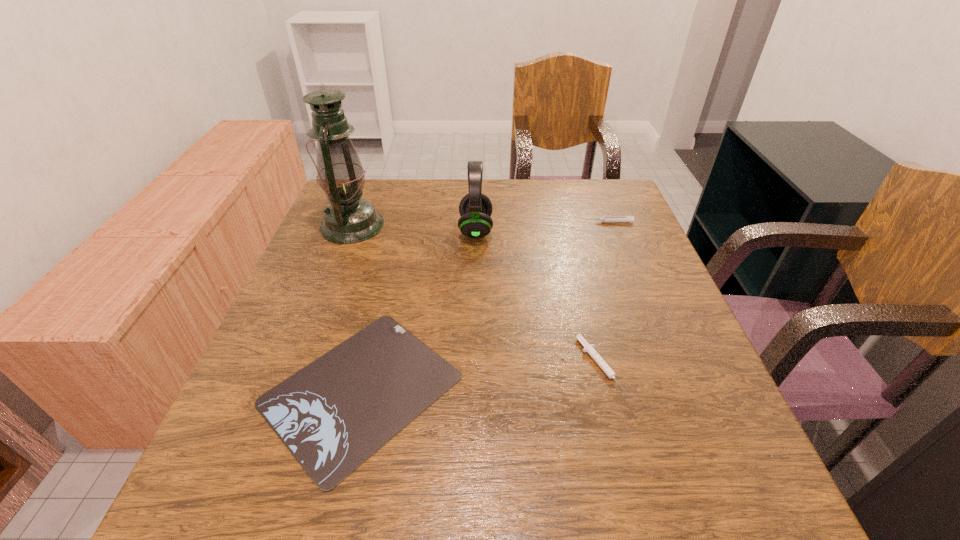
This screenshot has width=960, height=540. What are the coordinates of `object that is at the right edge` in the screenshot? It's located at (630, 219).

Find the location of `object at the far left corner`. object at the far left corner is located at coordinates (348, 219).

Find the location of a particular element. The width and height of the screenshot is (960, 540). object that is at the near left corner is located at coordinates (333, 414).

You are a GUI agent. You are given a task and a screenshot of the screen. Output one action in this format:
    pyautogui.click(x=<x>, y=<y>)
    Task: Click on the object at the far right corner
    
    Given the screenshot: What is the action you would take?
    pyautogui.click(x=630, y=219)

Locate an element on the screen. This screenshot has height=540, width=960. free space at the far edge of the desktop is located at coordinates (415, 190).

This screenshot has height=540, width=960. I want to click on vacant space at the near edge, so click(587, 492).

This screenshot has height=540, width=960. What are the coordinates of `blank space at the left edge` in the screenshot? It's located at (371, 254).

Image resolution: width=960 pixels, height=540 pixels. Identify the location of blank space at the right edge of the desktop. (633, 287).

In the image, there is a desktop. Where is `free space at the near left corner`? free space at the near left corner is located at coordinates (289, 502).

This screenshot has width=960, height=540. I want to click on vacant space at the far right corner of the desktop, so click(x=579, y=209).